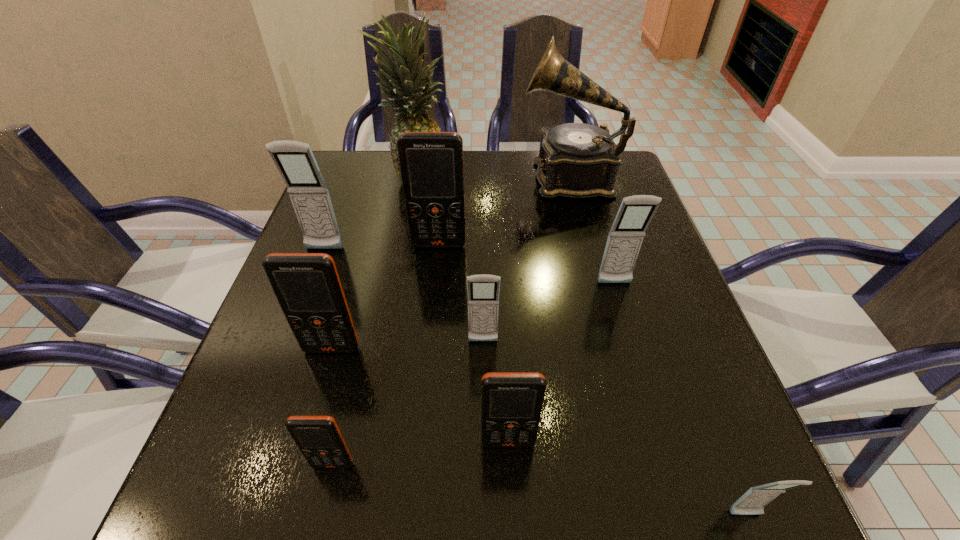
The image size is (960, 540). Find the location of `free space between the biggest gray cellular telephone and the green pineapple`. free space between the biggest gray cellular telephone and the green pineapple is located at coordinates (371, 213).

Locate an element on the screen. The image size is (960, 540). empty location between the second cellular telephone from right to left and the nearest object is located at coordinates (680, 400).

Locate an element on the screen. unoccupied area between the second nearest object and the leftmost gray cellular telephone is located at coordinates (328, 357).

Locate an element on the screen. Image resolution: width=960 pixels, height=540 pixels. vacant space that's between the third gray cellular telephone from left to right and the third nearest cellular telephone is located at coordinates (562, 363).

What are the coordinates of `unoccupied position between the phonograph record and the third gray cellular telephone from right to left` in the screenshot? It's located at (527, 259).

Find the location of a particular element. vacant area between the phonograph record and the seventh farthest cellular telephone is located at coordinates (451, 321).

At what (x,y) coordinates should I click in order to perform the action: click on vacant area that lies between the third biggest orange cellular telephone and the green pineapple. Please return your answer as a coordinate pair (x, y). Image resolution: width=960 pixels, height=540 pixels. Looking at the image, I should click on (463, 309).

The image size is (960, 540). In order to click on object that is the fifth nearest to the second biggest orange cellular telephone in this screenshot , I will do `click(511, 402)`.

Locate which object ranks sixth in proximity to the fifth farthest object. Please provide its 2D coordinates. Your answer should be formatted as a tuple, i.e. [(x, y)], where the tuple contains the x and y coordinates of a point satisfying the conditions above.

[(409, 88)]

Choose which cellular telephone is the fifth nearest neighbor to the farthest gray cellular telephone. Please provide its 2D coordinates. Your answer should be formatted as a tuple, i.e. [(x, y)], where the tuple contains the x and y coordinates of a point satisfying the conditions above.

[(511, 402)]